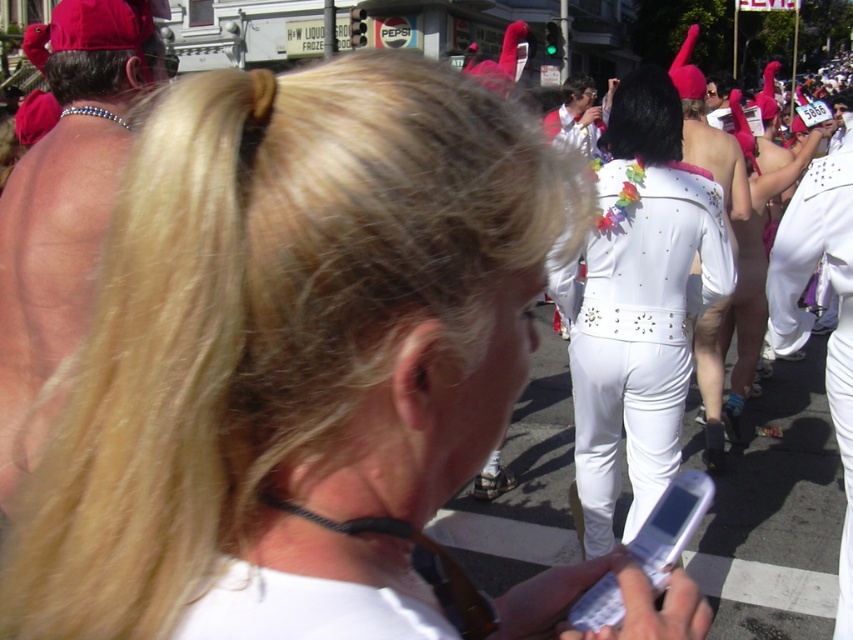
Does white shiny jumpsuit at center have a greater height compared to white plastic phone at center?

Yes.

Which is more to the right, white shiny jumpsuit at center or white plastic phone at center?

white shiny jumpsuit at center

I want to click on white shiny jumpsuit at center, so click(637, 330).